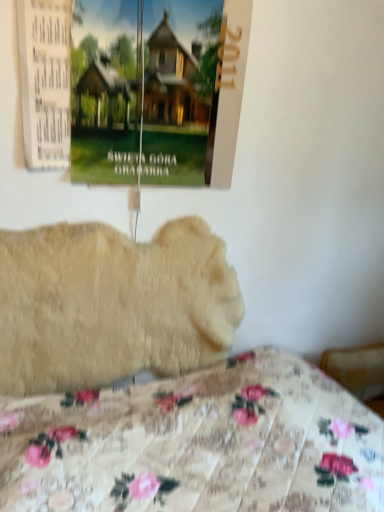
Question: Can you confirm if floral fabric bed at lower center is smaller than matte paper poster at upper left?

Choices:
 (A) no
 (B) yes

Answer: (A)

Question: Does floral fabric bed at lower center turn towards matte paper poster at upper left?

Choices:
 (A) yes
 (B) no

Answer: (B)

Question: Is the position of floral fabric bed at lower center less distant than that of matte paper poster at upper left?

Choices:
 (A) yes
 (B) no

Answer: (A)

Question: Is floral fabric bed at lower center looking in the opposite direction of matte paper poster at upper left?

Choices:
 (A) no
 (B) yes

Answer: (A)

Question: Is the position of floral fabric bed at lower center more distant than that of matte paper poster at upper left?

Choices:
 (A) no
 (B) yes

Answer: (A)

Question: Does floral fabric bed at lower center have a larger size compared to matte paper poster at upper left?

Choices:
 (A) yes
 (B) no

Answer: (A)

Question: Is floral fabric bed at lower center closer to the viewer compared to fluffy beige dog at center?

Choices:
 (A) no
 (B) yes

Answer: (B)

Question: Is floral fabric bed at lower center in contact with fluffy beige dog at center?

Choices:
 (A) yes
 (B) no

Answer: (B)

Question: Can you confirm if floral fabric bed at lower center is positioned to the right of fluffy beige dog at center?

Choices:
 (A) no
 (B) yes

Answer: (B)

Question: Is floral fabric bed at lower center aimed at fluffy beige dog at center?

Choices:
 (A) yes
 (B) no

Answer: (B)

Question: Is floral fabric bed at lower center thinner than fluffy beige dog at center?

Choices:
 (A) yes
 (B) no

Answer: (B)

Question: Is fluffy beige dog at center surrounded by floral fabric bed at lower center?

Choices:
 (A) no
 (B) yes

Answer: (A)

Question: Does matte paper poster at upper left appear on the right side of fluffy beige dog at center?

Choices:
 (A) yes
 (B) no

Answer: (A)